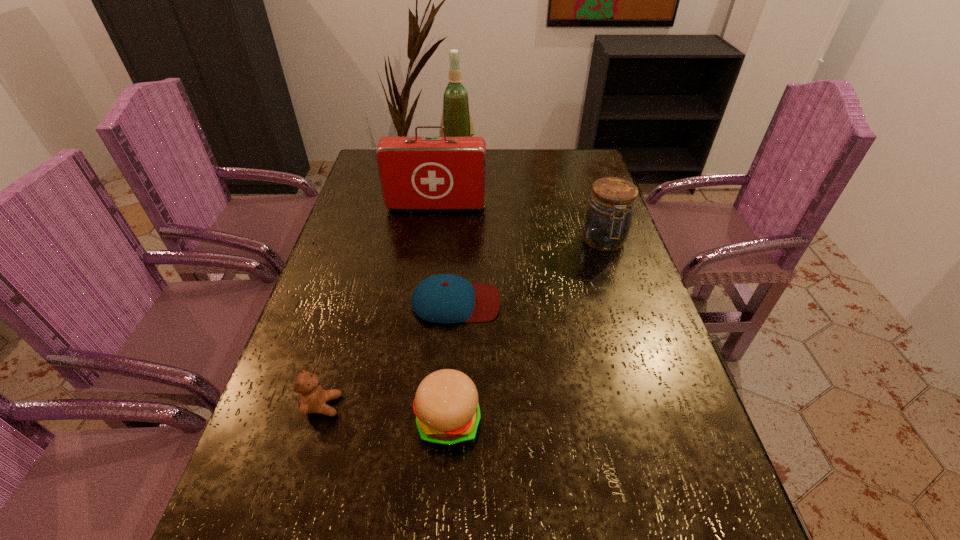
At what (x,y) coordinates should I click in order to perform the action: click on the farthest object. Please return your answer as a coordinate pair (x, y). The width and height of the screenshot is (960, 540). Looking at the image, I should click on (456, 118).

At what (x,y) coordinates should I click in order to perform the action: click on wine bottle. Please return your answer as a coordinate pair (x, y). Image resolution: width=960 pixels, height=540 pixels. Looking at the image, I should click on (456, 118).

Locate an element on the screen. Image resolution: width=960 pixels, height=540 pixels. the first-aid kit is located at coordinates (416, 173).

Locate an element on the screen. The image size is (960, 540). the second tallest object is located at coordinates (416, 173).

You are a GUI agent. You are given a task and a screenshot of the screen. Output one action in this format:
    pyautogui.click(x=<x>, y=<y>)
    Task: Click on the jar
    
    Given the screenshot: What is the action you would take?
    pyautogui.click(x=607, y=222)

Image resolution: width=960 pixels, height=540 pixels. Identify the location of the third farthest object. (607, 222).

Locate an element on the screen. hamburger is located at coordinates (446, 406).

The width and height of the screenshot is (960, 540). What are the coordinates of `teddy bear` in the screenshot? It's located at (312, 398).

Where is `the third nearest object`? The height and width of the screenshot is (540, 960). the third nearest object is located at coordinates (444, 298).

I want to click on the shortest object, so click(x=444, y=298).